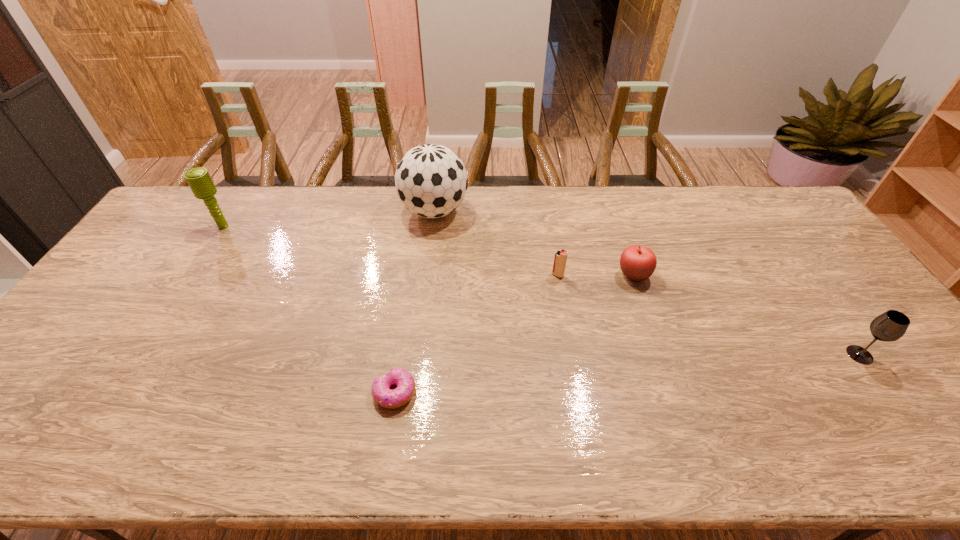
In the image, there is a desktop. At what (x,y) coordinates should I click in order to perform the action: click on vacant space at the near right corner. Please return your answer as a coordinate pair (x, y). This screenshot has height=540, width=960. Looking at the image, I should click on (903, 441).

Where is `free spot between the leftmost object and the third object from right to left`? The image size is (960, 540). free spot between the leftmost object and the third object from right to left is located at coordinates (391, 251).

The height and width of the screenshot is (540, 960). What are the coordinates of `vacant region between the microphone and the soccer ball` in the screenshot? It's located at coord(329,219).

You are a GUI agent. You are given a task and a screenshot of the screen. Output one action in this format:
    pyautogui.click(x=<x>, y=<y>)
    Task: Click on the free point between the third object from right to left and the second object from right to left
    This screenshot has height=540, width=960.
    Given the screenshot: What is the action you would take?
    (x=595, y=275)

Identify the location of free space between the apple and the microphone. (429, 251).

This screenshot has height=540, width=960. I want to click on vacant area between the wineglass and the soccer ball, so click(x=647, y=283).

The image size is (960, 540). Identify the location of vacant space in between the doughnut and the rightmost object. (627, 374).

I want to click on empty space that is in between the fourth object from left to right and the microphone, so click(x=391, y=251).

Find the location of a particular element. The image size is (960, 540). free point between the second nearest object and the soccer ball is located at coordinates (647, 283).

This screenshot has height=540, width=960. I want to click on empty location between the second nearest object and the fourth object from left to right, so click(x=708, y=315).